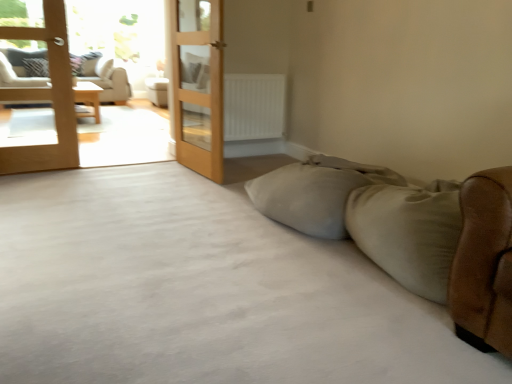
Identify the location of light brown wooden door at center, the first door when ordered from right to left. The width and height of the screenshot is (512, 384). (198, 85).

Describe the element at coordinates (88, 98) in the screenshot. The width and height of the screenshot is (512, 384). I see `wooden table at left` at that location.

Looking at this image, in order to face light brown wooden terrace at left, should I rotate leftwards or rightwards?

You should look left and rotate roughly 21.635 degrees.

Describe the element at coordinates (46, 97) in the screenshot. I see `light brown wooden terrace at left` at that location.

You are a GUI agent. You are given a task and a screenshot of the screen. Output one action in this format:
    pyautogui.click(x=<x>, y=<y>)
    Task: Click on the matte white side table at center
    
    Given the screenshot: What is the action you would take?
    pyautogui.click(x=157, y=91)

In order to face light brown wooden door at left, marked as the 2th door in a right-to-left arrangement, should I rotate leftwards or rightwards?

A 27.881 degree turn to the left will do.

This screenshot has width=512, height=384. Describe the element at coordinates (46, 98) in the screenshot. I see `light brown wooden door at left, marked as the 2th door in a right-to-left arrangement` at that location.

You are a GUI agent. You are given a task and a screenshot of the screen. Output one action in this format:
    pyautogui.click(x=<x>, y=<y>)
    Task: Click on the light brown wooden door at center, the first door when ordered from right to left
    
    Given the screenshot: What is the action you would take?
    pyautogui.click(x=198, y=85)

From the image's perspective, is light brown wooden terrace at left above matte white side table at center?

No, from the image's perspective, light brown wooden terrace at left is not over matte white side table at center.

From a real-world perspective, which object rests below the other?

matte white side table at center, from a real-world perspective.

Is light brown wooden terrace at left with matte white side table at center?

No, light brown wooden terrace at left is not beside matte white side table at center.

Considering the positions of point (50, 57) and point (96, 65), is point (50, 57) closer or farther from the camera than point (96, 65)?

Clearly, point (50, 57) is closer to the camera than point (96, 65).

Which of these two, light brown wooden terrace at left or matte white couch at left, arranged as the first studio couch when viewed from the back, stands taller?

light brown wooden terrace at left.

Is light brown wooden terrace at left smaller than matte white couch at left, arranged as the first studio couch when viewed from the back?

Correct, light brown wooden terrace at left occupies less space than matte white couch at left, arranged as the first studio couch when viewed from the back.

Between light brown wooden terrace at left and matte white couch at left, the second studio couch when ordered from front to back, which one appears on the right side from the viewer's perspective?

Positioned to the right is light brown wooden terrace at left.

Considering the sizes of matte white side table at center and white matte radiator at center in the image, is matte white side table at center bigger or smaller than white matte radiator at center?

matte white side table at center is bigger than white matte radiator at center.

Is matte white side table at center outside of white matte radiator at center?

Yes, matte white side table at center is not within white matte radiator at center.

Is matte white side table at center turned away from white matte radiator at center?

No, white matte radiator at center is not at the back of matte white side table at center.

The height and width of the screenshot is (384, 512). In order to click on radiator that is on the right side of matte white side table at center in this screenshot , I will do `click(254, 106)`.

Considering the positions of objects light brown wooden door at center, the second door positioned from the left, and wooden table at left in the image provided, who is behind, light brown wooden door at center, the second door positioned from the left, or wooden table at left?

wooden table at left is more distant.

Which is farther from the camera, (212,7) or (92,104)?

Positioned behind is point (92,104).

Is light brown wooden door at center, the second door positioned from the left, not close to wooden table at left?

Absolutely, light brown wooden door at center, the second door positioned from the left, is distant from wooden table at left.

Consider the image. How distant is light brown wooden door at center, the second door positioned from the left, from wooden table at left?

light brown wooden door at center, the second door positioned from the left, is 2.04 meters away from wooden table at left.

Is matte white side table at center facing away from light brown wooden terrace at left?

No.

What's the angular difference between matte white side table at center and light brown wooden terrace at left's facing directions?

3.3 degrees.

Can you confirm if matte white side table at center is wider than light brown wooden terrace at left?

Indeed, matte white side table at center has a greater width compared to light brown wooden terrace at left.

Between point (152, 99) and point (10, 158), which one is positioned in front?

The point (10, 158) is in front.

From a real-world perspective, is light brown wooden door at left, marked as the 2th door in a right-to-left arrangement, physically located above or below matte white couch at left, the second studio couch positioned from the bottom?

light brown wooden door at left, marked as the 2th door in a right-to-left arrangement, is situated higher than matte white couch at left, the second studio couch positioned from the bottom, in the real world.

Consider the image. Considering the relative positions of light brown wooden door at left, placed as the 1th door when sorted from left to right, and matte white couch at left, which is the first studio couch in top-to-bottom order, in the image provided, is light brown wooden door at left, placed as the 1th door when sorted from left to right, behind matte white couch at left, which is the first studio couch in top-to-bottom order,?

No, it is not.

How distant is light brown wooden door at left, marked as the 2th door in a right-to-left arrangement, from matte white couch at left, the second studio couch positioned from the bottom?

8.29 feet.

Is light brown wooden door at left, marked as the 2th door in a right-to-left arrangement, oriented towards matte white couch at left, arranged as the first studio couch when viewed from the back?

No, light brown wooden door at left, marked as the 2th door in a right-to-left arrangement, is not facing towards matte white couch at left, arranged as the first studio couch when viewed from the back.

Considering the positions of point (217, 91) and point (4, 64), is point (217, 91) closer or farther from the camera than point (4, 64)?

Point (217, 91) is closer to the camera than point (4, 64).

From the image's perspective, is light brown wooden door at center, the second door positioned from the left, below matte white couch at left, the 1th studio couch positioned from the left?

Yes, from the image's perspective, light brown wooden door at center, the second door positioned from the left, is below matte white couch at left, the 1th studio couch positioned from the left.

Is light brown wooden door at center, the second door positioned from the left, positioned in front of matte white couch at left, which is the first studio couch in top-to-bottom order?

Yes, the depth of light brown wooden door at center, the second door positioned from the left, is less than that of matte white couch at left, which is the first studio couch in top-to-bottom order.

The image size is (512, 384). I want to click on furniture behind the light brown wooden terrace at left, so click(157, 91).

Find the location of `terrace below the matte white couch at left, which is the first studio couch in top-to-bottom order (from the image's perspective)`. terrace below the matte white couch at left, which is the first studio couch in top-to-bottom order (from the image's perspective) is located at coordinates (46, 97).

Which object lies nearer to the anchor point light brown wooden door at center, the first door when ordered from right to left, wooden table at left or white matte radiator at center?

Based on the image, white matte radiator at center appears to be nearer to light brown wooden door at center, the first door when ordered from right to left.

Based on their spatial positions, is matte white side table at center or brown leather studio couch at right, the second studio couch from the top, closer to wooden table at left?

matte white side table at center.

Looking at the image, which one is located closer to matte white side table at center, white matte radiator at center or brown leather studio couch at right, placed as the 2th studio couch when sorted from left to right?

white matte radiator at center is positioned closer to the anchor matte white side table at center.

Estimate the real-world distances between objects in this image. Which object is closer to brown leather studio couch at right, which appears as the first studio couch when viewed from the right, white matte radiator at center or wooden table at left?

Among the two, white matte radiator at center is located nearer to brown leather studio couch at right, which appears as the first studio couch when viewed from the right.

Considering their positions, is light brown wooden door at center, the first door when ordered from right to left, positioned further to matte white side table at center than light brown wooden terrace at left?

Based on the image, light brown wooden terrace at left appears to be further to matte white side table at center.

Based on their spatial positions, is light brown wooden door at left, placed as the 1th door when sorted from left to right, or light brown wooden terrace at left further from light brown wooden door at center, the second door positioned from the left?

The object further to light brown wooden door at center, the second door positioned from the left, is light brown wooden terrace at left.

Considering their positions, is wooden table at left positioned closer to matte white side table at center than light brown wooden terrace at left?

wooden table at left is closer to matte white side table at center.

From the image, which object appears to be farther from matte white side table at center, light brown wooden terrace at left or matte white couch at left, which appears as the second studio couch when viewed from the right?

light brown wooden terrace at left is positioned further to the anchor matte white side table at center.

What are the coordinates of `table positioned between brown leather studio couch at right, the 1th studio couch viewed from the front, and matte white side table at center from near to far` in the screenshot? It's located at pos(88,98).

Identify the location of table between white matte radiator at center and matte white side table at center from front to back. The image size is (512, 384). (88, 98).

At what (x,y) coordinates should I click in order to perform the action: click on terrace between light brown wooden door at center, the first door when ordered from right to left, and matte white side table at center, along the z-axis. Please return your answer as a coordinate pair (x, y). The image size is (512, 384). Looking at the image, I should click on (46, 97).

You are a GUI agent. You are given a task and a screenshot of the screen. Output one action in this format:
    pyautogui.click(x=<x>, y=<y>)
    Task: Click on the radiator positioned between light brown wooden door at left, marked as the 2th door in a right-to-left arrangement, and wooden table at left from near to far
    
    Given the screenshot: What is the action you would take?
    pyautogui.click(x=254, y=106)